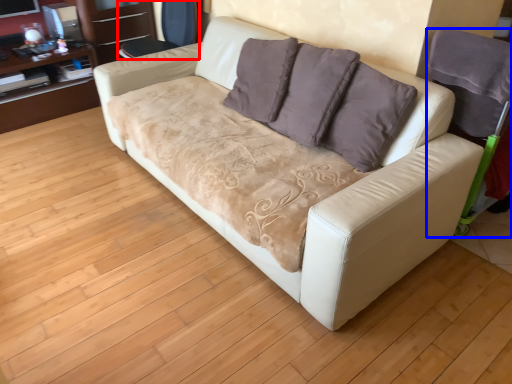
Question: Among these objects, which one is farthest to the camera, armchair (highlighted by a red box) or armchair (highlighted by a blue box)?

Choices:
 (A) armchair
 (B) armchair

Answer: (A)